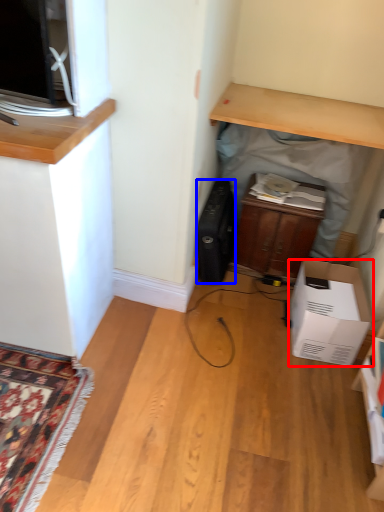
Question: Which of the following is the closest to the observer, cardboard box (highlighted by a red box) or appliance (highlighted by a blue box)?

Choices:
 (A) cardboard box
 (B) appliance

Answer: (A)